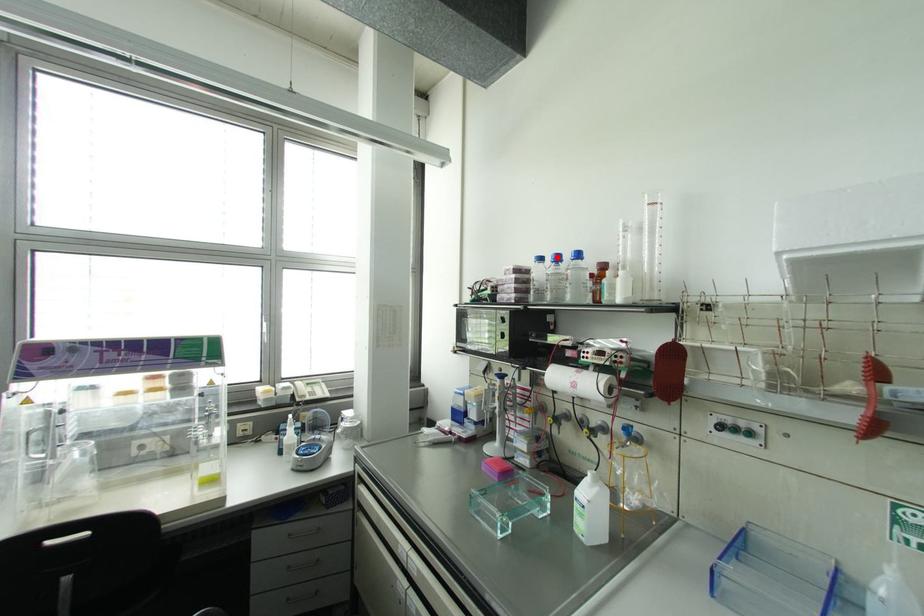
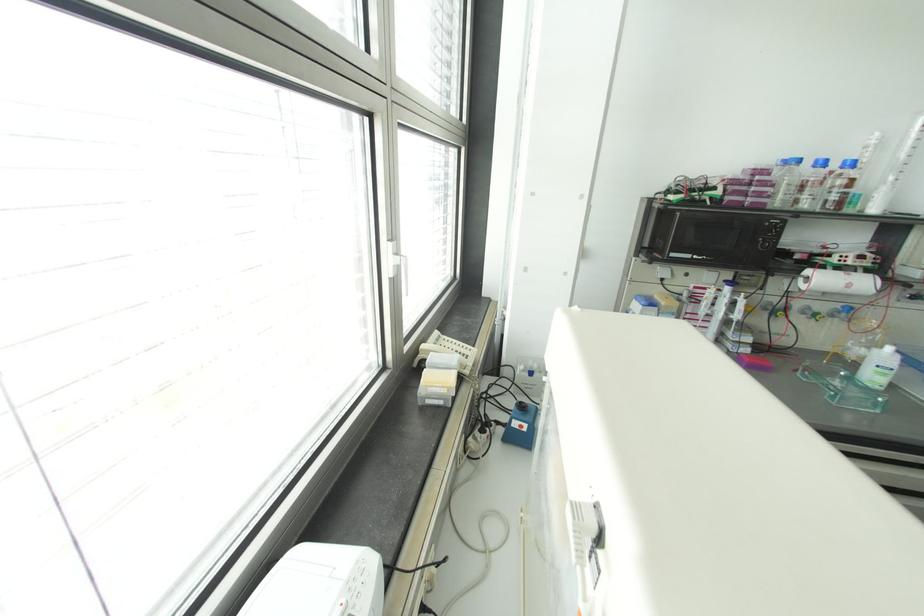
The point at the highlighted location is marked in the first image. Where is the corresponding point in the second image?

(822, 163)